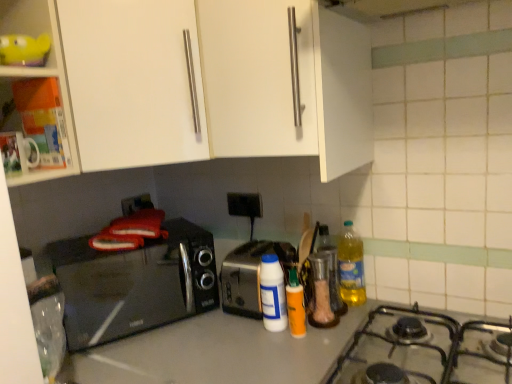
Question: Is silver metallic toaster at center positioned before orange matte bottle at center, acting as the 2th bottle starting from the left?

Choices:
 (A) yes
 (B) no

Answer: (B)

Question: Can we say silver metallic toaster at center lies outside orange matte bottle at center, the second bottle from the right?

Choices:
 (A) yes
 (B) no

Answer: (A)

Question: Considering the relative sizes of silver metallic toaster at center and orange matte bottle at center, acting as the 2th bottle starting from the left, in the image provided, is silver metallic toaster at center taller than orange matte bottle at center, acting as the 2th bottle starting from the left,?

Choices:
 (A) yes
 (B) no

Answer: (A)

Question: Considering the relative sizes of silver metallic toaster at center and orange matte bottle at center, the second bottle from the right, in the image provided, is silver metallic toaster at center smaller than orange matte bottle at center, the second bottle from the right,?

Choices:
 (A) no
 (B) yes

Answer: (A)

Question: Is silver metallic toaster at center shorter than orange matte bottle at center, the second bottle from the right?

Choices:
 (A) yes
 (B) no

Answer: (B)

Question: From the image's perspective, relative to yellow plastic container at upper left, is clear glass container at center above or below?

Choices:
 (A) above
 (B) below

Answer: (B)

Question: From their relative heights in the image, would you say clear glass container at center is taller or shorter than yellow plastic container at upper left?

Choices:
 (A) short
 (B) tall

Answer: (B)

Question: Do you think clear glass container at center is within yellow plastic container at upper left, or outside of it?

Choices:
 (A) inside
 (B) outside

Answer: (B)

Question: Based on their sizes in the image, would you say clear glass container at center is bigger or smaller than yellow plastic container at upper left?

Choices:
 (A) small
 (B) big

Answer: (B)

Question: In the image, is silver metallic toaster at center on the left side or the right side of black plastic outlet at center?

Choices:
 (A) left
 (B) right

Answer: (B)

Question: From the image's perspective, is silver metallic toaster at center above or below black plastic outlet at center?

Choices:
 (A) below
 (B) above

Answer: (A)

Question: Considering their positions, is silver metallic toaster at center located in front of or behind black plastic outlet at center?

Choices:
 (A) front
 (B) behind

Answer: (A)

Question: Is point (237, 276) positioned closer to the camera than point (229, 198)?

Choices:
 (A) farther
 (B) closer

Answer: (B)

Question: Based on their positions, is orange matte bottle at center, the second bottle from the right, located to the left or right of yellow translucent bottle at right?

Choices:
 (A) right
 (B) left

Answer: (B)

Question: Considering the positions of orange matte bottle at center, the second bottle from the right, and yellow translucent bottle at right in the image, is orange matte bottle at center, the second bottle from the right, taller or shorter than yellow translucent bottle at right?

Choices:
 (A) short
 (B) tall

Answer: (A)